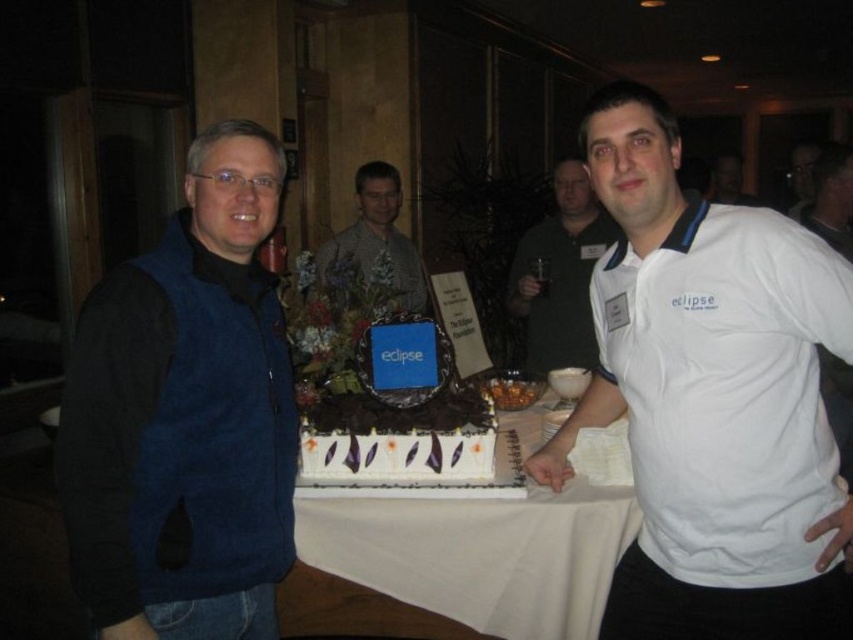
Who is higher up, chocolatesmoothcake at center or patterned fabric shirt at center?

patterned fabric shirt at center is above.

Which of these two, chocolatesmoothcake at center or patterned fabric shirt at center, stands shorter?

With less height is chocolatesmoothcake at center.

The image size is (853, 640). I want to click on chocolatesmoothcake at center, so click(x=399, y=442).

Is blue fleece vest at left bigger than chocolatesmoothcake at center?

Correct, blue fleece vest at left is larger in size than chocolatesmoothcake at center.

Measure the distance between blue fleece vest at left and camera.

blue fleece vest at left and camera are 1.21 meters apart.

Who is more distant from viewer, (254, 582) or (368, 436)?

Point (368, 436)

Find the location of a particular element. The image size is (853, 640). blue fleece vest at left is located at coordinates (184, 416).

Can you confirm if white cotton shirt at center is positioned to the left of white cotton polo shirt at center?

Correct, you'll find white cotton shirt at center to the left of white cotton polo shirt at center.

I want to click on white cotton shirt at center, so click(x=712, y=397).